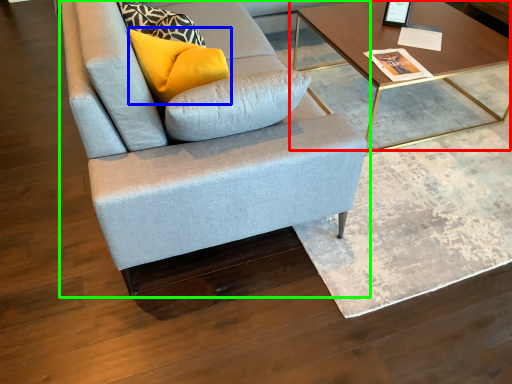
Question: Which is farther away from coffee table (highlighted by a red box)? pillow (highlighted by a blue box) or studio couch (highlighted by a green box)?

Choices:
 (A) pillow
 (B) studio couch

Answer: (A)